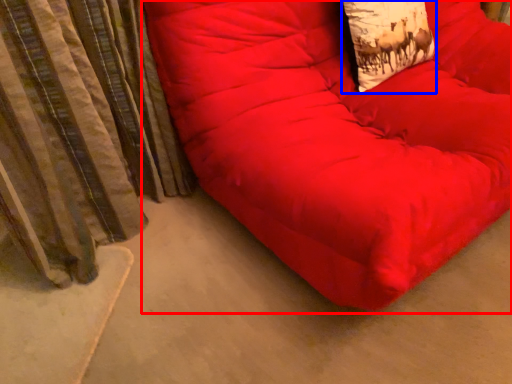
Question: Which of the following is the closest to the observer, furniture (highlighted by a red box) or throw pillow (highlighted by a blue box)?

Choices:
 (A) furniture
 (B) throw pillow

Answer: (A)